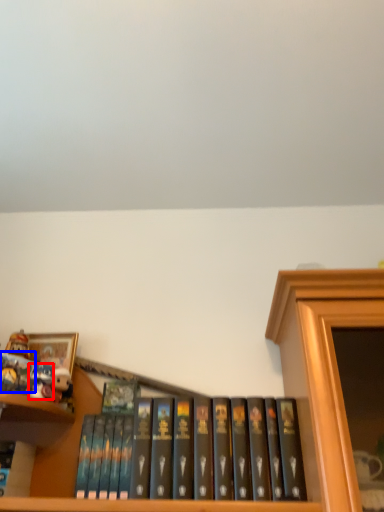
Question: Which object is further to the camera taking this photo, toy (highlighted by a red box) or book (highlighted by a blue box)?

Choices:
 (A) toy
 (B) book

Answer: (A)